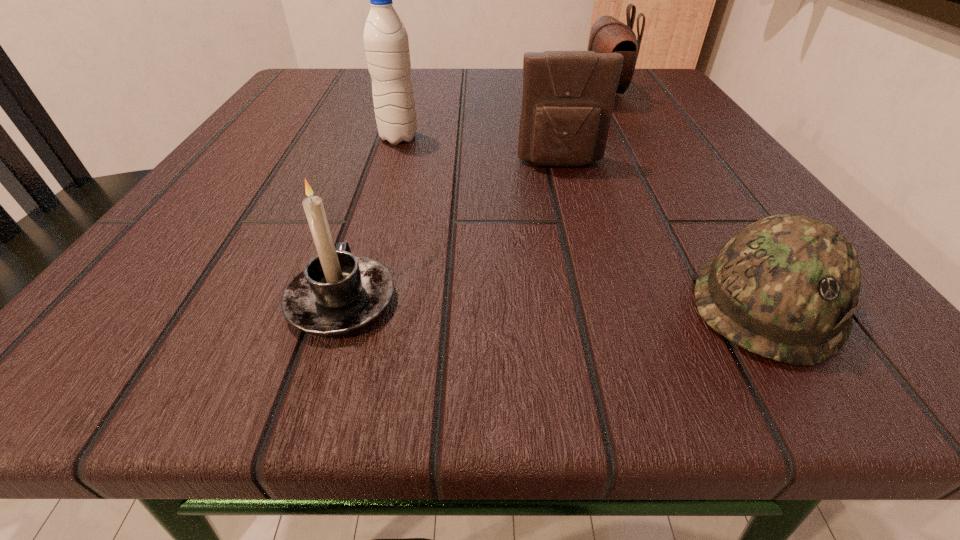
At what (x,y) coordinates should I click in order to perform the action: click on free space located with the flap open on the farthest object. Please return your answer as a coordinate pair (x, y). Image resolution: width=960 pixels, height=540 pixels. Looking at the image, I should click on (528, 93).

You are a GUI agent. You are given a task and a screenshot of the screen. Output one action in this format:
    pyautogui.click(x=<x>, y=<y>)
    Task: Click on the free spot located 0.270m with the flap open on the farthest object
    The image size is (960, 540).
    Given the screenshot: What is the action you would take?
    pyautogui.click(x=439, y=93)

The width and height of the screenshot is (960, 540). I want to click on vacant space located 0.320m with the flap open on the farthest object, so click(413, 93).

This screenshot has height=540, width=960. I want to click on vacant region located 0.280m with a handle on the side of the candle holder, so click(x=391, y=146).

Where is `free space located with a handle on the side of the candle holder`? This screenshot has height=540, width=960. free space located with a handle on the side of the candle holder is located at coordinates (368, 217).

Where is `vacant space located 0.180m with a handle on the side of the candle holder`? The width and height of the screenshot is (960, 540). vacant space located 0.180m with a handle on the side of the candle holder is located at coordinates (380, 179).

Find the location of a particular element. The width and height of the screenshot is (960, 540). vacant space located on the back of the headwear is located at coordinates (679, 167).

You are a GUI agent. You are given a task and a screenshot of the screen. Output one action in this format:
    pyautogui.click(x=<x>, y=<y>)
    Task: Click on the object situated at the far edge
    The height and width of the screenshot is (540, 960).
    Given the screenshot: What is the action you would take?
    pyautogui.click(x=608, y=35)

The image size is (960, 540). I want to click on candle holder located in the near edge section of the desktop, so click(x=336, y=293).

This screenshot has width=960, height=540. In order to click on headwear that is at the near edge in this screenshot , I will do `click(785, 287)`.